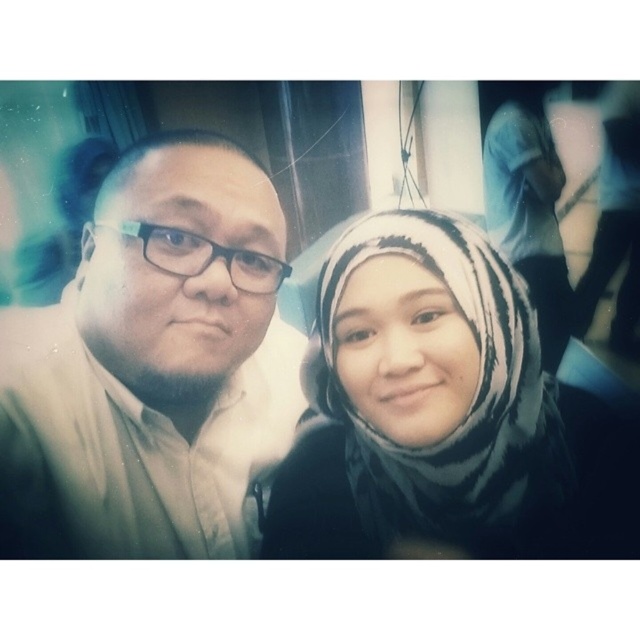
Question: From the image, what is the correct spatial relationship of matte beige shirt at left in relation to white striped scarf at upper right?

Choices:
 (A) below
 (B) above

Answer: (A)

Question: Is matte beige shirt at left thinner than black and white patterned hijab at center?

Choices:
 (A) no
 (B) yes

Answer: (B)

Question: Is matte black shirt at center smaller than matte beige shirt at left?

Choices:
 (A) no
 (B) yes

Answer: (A)

Question: Which object is the farthest from the matte beige shirt at left?

Choices:
 (A) white striped scarf at upper right
 (B) matte black shirt at center
 (C) black and white patterned hijab at center

Answer: (A)

Question: Among these points, which one is farthest from the camera?

Choices:
 (A) (484, 147)
 (B) (352, 509)
 (C) (115, 465)

Answer: (A)

Question: Which point is closer to the camera taking this photo?

Choices:
 (A) (35, 317)
 (B) (496, 346)
 (C) (570, 317)
 (D) (157, 340)

Answer: (D)